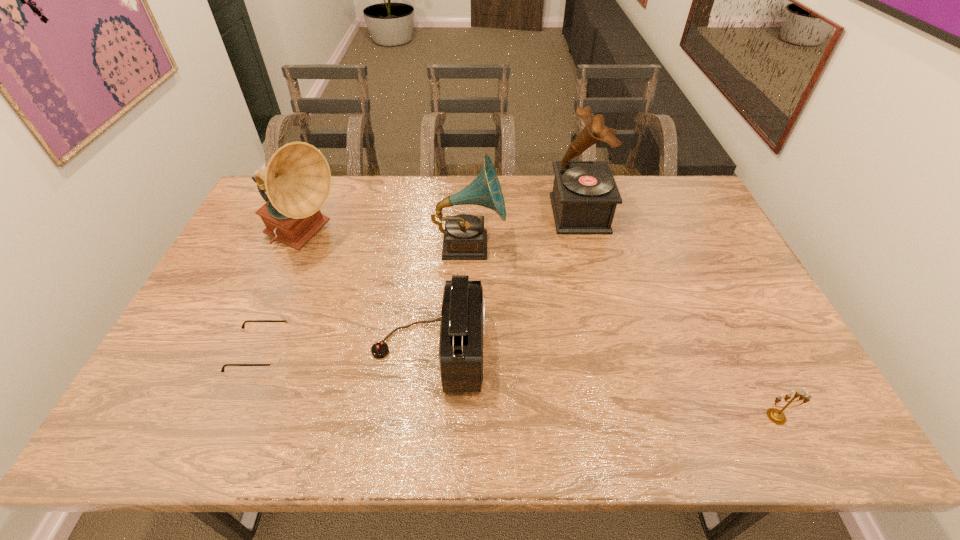
Identify the location of the rightmost phonograph_record. The image size is (960, 540). (584, 198).

Where is `the leftmost phonograph_record`? the leftmost phonograph_record is located at coordinates (297, 179).

Where is `the shortest phonograph_record`? This screenshot has height=540, width=960. the shortest phonograph_record is located at coordinates (464, 238).

Image resolution: width=960 pixels, height=540 pixels. In order to click on the third tallest object in this screenshot , I will do `click(464, 238)`.

Where is `the third shortest object`? This screenshot has height=540, width=960. the third shortest object is located at coordinates click(462, 327).

The height and width of the screenshot is (540, 960). I want to click on the rightmost object, so click(777, 416).

Locate an element on the screen. The width and height of the screenshot is (960, 540). the nearest object is located at coordinates (777, 416).

Locate an element on the screen. This screenshot has height=540, width=960. spectacles is located at coordinates (276, 359).

Image resolution: width=960 pixels, height=540 pixels. I want to click on free spot located at the horn opening of the second object from right to left, so click(522, 213).

Find the location of `free region located 0.060m at the horn opening of the second object from right to left`. free region located 0.060m at the horn opening of the second object from right to left is located at coordinates (535, 213).